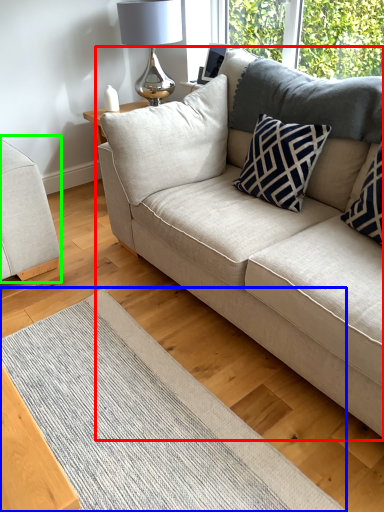
Question: Which is farther away from studio couch (highlighted by a red box)? mat (highlighted by a blue box) or studio couch (highlighted by a green box)?

Choices:
 (A) mat
 (B) studio couch

Answer: (B)